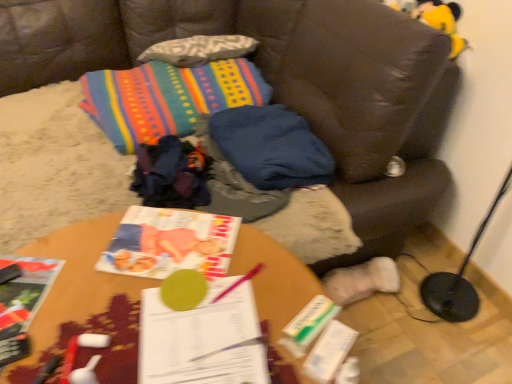
Question: Could you tell me if wooden table at center is turned towards multicolored woven blanket at upper center?

Choices:
 (A) yes
 (B) no

Answer: (B)

Question: Is wooden table at center looking in the opposite direction of multicolored woven blanket at upper center?

Choices:
 (A) no
 (B) yes

Answer: (B)

Question: Is wooden table at center next to multicolored woven blanket at upper center?

Choices:
 (A) yes
 (B) no

Answer: (B)

Question: Could multicolored woven blanket at upper center be considered to be inside wooden table at center?

Choices:
 (A) no
 (B) yes

Answer: (A)

Question: Considering the relative positions of wooden table at center and multicolored woven blanket at upper center in the image provided, is wooden table at center to the right of multicolored woven blanket at upper center from the viewer's perspective?

Choices:
 (A) yes
 (B) no

Answer: (A)

Question: Is point (76, 309) positioned closer to the camera than point (434, 23)?

Choices:
 (A) closer
 (B) farther

Answer: (A)

Question: From the image's perspective, is wooden table at center positioned above or below yellow plush toy at upper right?

Choices:
 (A) below
 (B) above

Answer: (A)

Question: Visually, is wooden table at center positioned to the left or to the right of yellow plush toy at upper right?

Choices:
 (A) left
 (B) right

Answer: (A)

Question: Is wooden table at center bigger or smaller than yellow plush toy at upper right?

Choices:
 (A) big
 (B) small

Answer: (A)

Question: Is white paper book at center, which is the first book in right-to-left order, situated inside brown leather couch at center or outside?

Choices:
 (A) outside
 (B) inside

Answer: (A)

Question: Is white paper book at center, which is the first book in right-to-left order, wider or thinner than brown leather couch at center?

Choices:
 (A) wide
 (B) thin

Answer: (B)

Question: Is white paper book at center, the 3th book positioned from the left, taller or shorter than brown leather couch at center?

Choices:
 (A) tall
 (B) short

Answer: (B)

Question: Is white paper book at center, which is the first book in right-to-left order, to the left or to the right of brown leather couch at center in the image?

Choices:
 (A) left
 (B) right

Answer: (B)

Question: Is matte paper book at center, the second book viewed from the left, spatially inside white paper book at center, which is the first book in right-to-left order, or outside of it?

Choices:
 (A) outside
 (B) inside

Answer: (A)

Question: Would you say matte paper book at center, the second book viewed from the left, is to the left or to the right of white paper book at center, the 3th book positioned from the left, in the picture?

Choices:
 (A) right
 (B) left

Answer: (B)